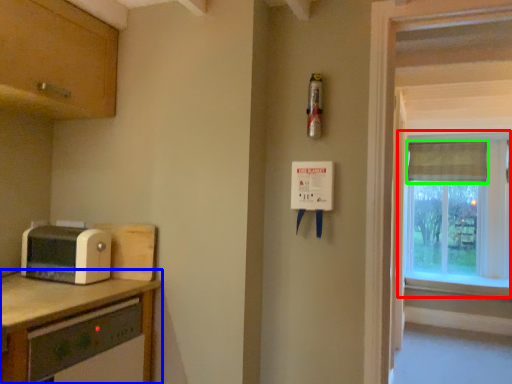
Question: Which is farther away from window (highlighted by a red box)? countertop (highlighted by a blue box) or curtain (highlighted by a green box)?

Choices:
 (A) countertop
 (B) curtain

Answer: (A)